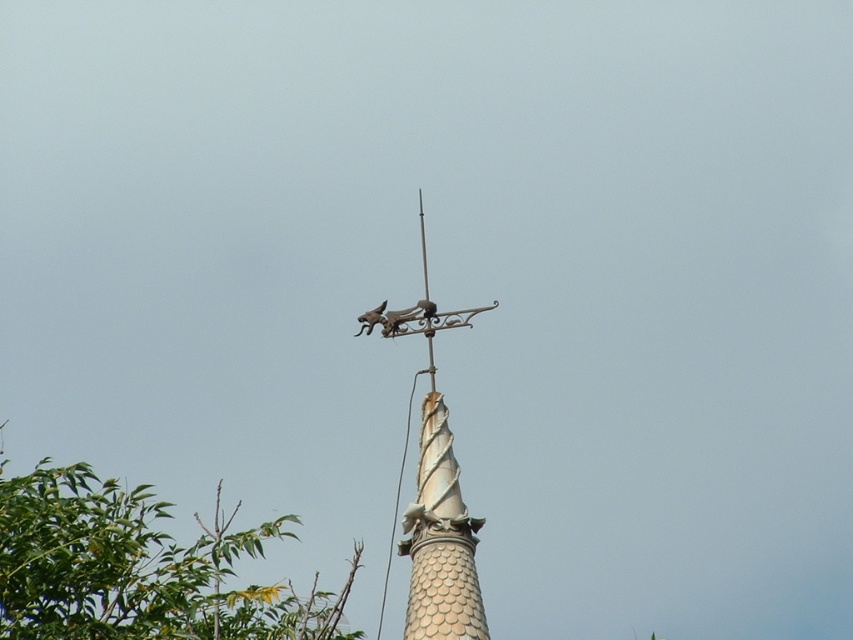
You are standing in a park and see a weather vane on a spire. There is a point marked at coordinates [138,568]. Based on the scene description, can you determine what object this point is located on?

The point is located on the green leafy tree at upper left.

You are standing at the base of the spire and looking upward. You see two points marked on the weather vane. Which point is closer to you when you look up? The points are labeled as point (x=57, y=481) and point (x=401, y=467).

Point (x=57, y=481) is in front of point (x=401, y=467), so it is closer to you when looking upward.

You are an architect designing a new building and want to install a weather vane similar to the one shown. The building has a spire with limited space. Given that the metallic weather vane at center is larger than the metallic gray bird at top, which part should you prioritize reducing in size to fit within the space constraints?

You should prioritize reducing the size of the metallic weather vane at center since it is larger than the metallic gray bird at top, making it the component that occupies more space.